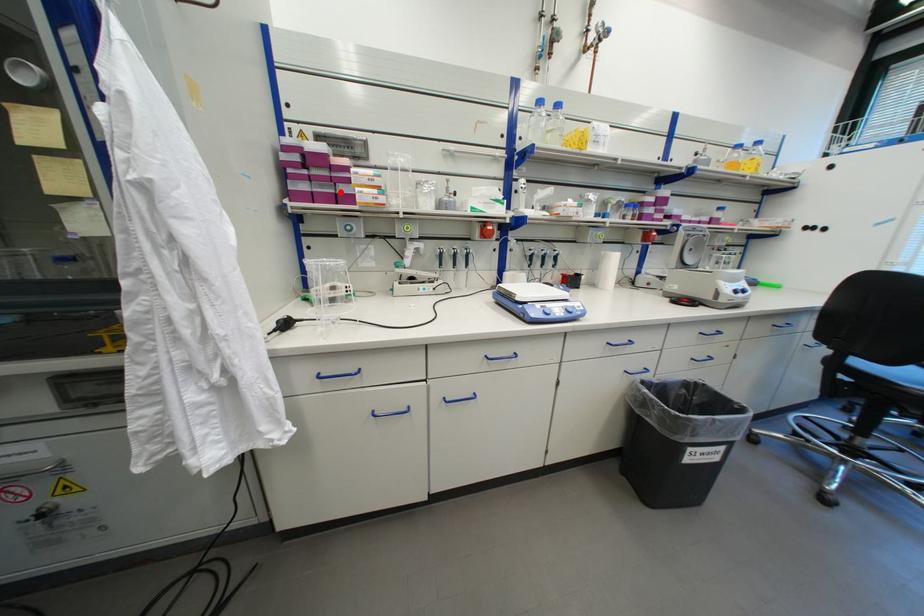
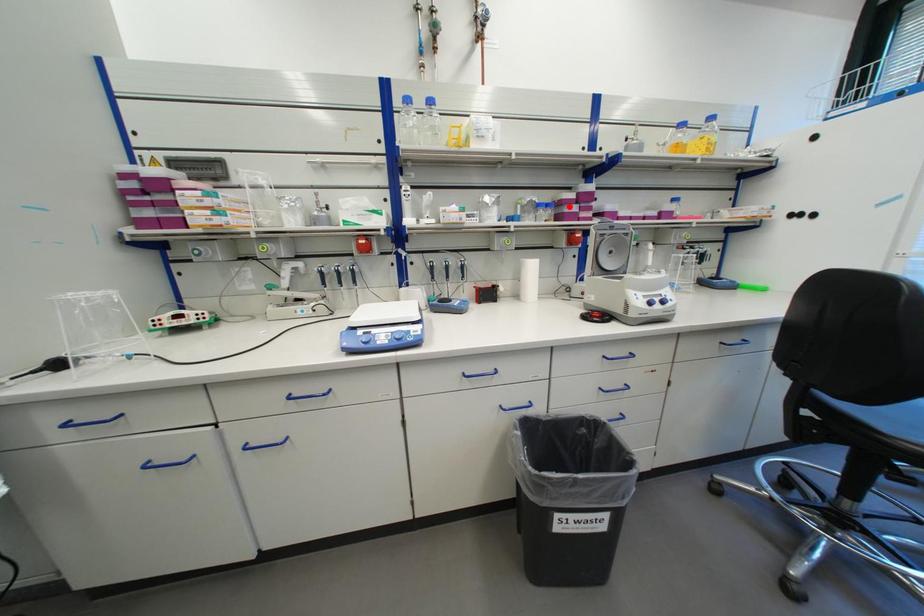
I am providing you with two images of the same scene from different viewpoints. A red point is marked on the first image and another point is marked on the second image. Is the marked point in image1 the same physical position as the marked point in image2?

No